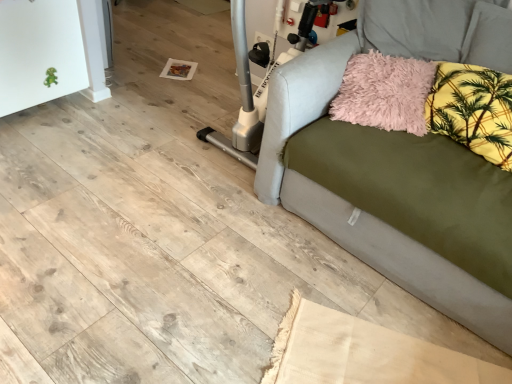
Question: Is beige fabric rug at lower center at the right side of yellow floral fabric pillow at upper right, acting as the 1th pillow starting from the right?

Choices:
 (A) no
 (B) yes

Answer: (A)

Question: Is the depth of beige fabric rug at lower center greater than that of yellow floral fabric pillow at upper right, acting as the 1th pillow starting from the right?

Choices:
 (A) yes
 (B) no

Answer: (B)

Question: From the image's perspective, is beige fabric rug at lower center located above yellow floral fabric pillow at upper right, the 2th pillow from the left?

Choices:
 (A) yes
 (B) no

Answer: (B)

Question: Considering the relative sizes of beige fabric rug at lower center and yellow floral fabric pillow at upper right, acting as the 1th pillow starting from the right, in the image provided, is beige fabric rug at lower center thinner than yellow floral fabric pillow at upper right, acting as the 1th pillow starting from the right,?

Choices:
 (A) no
 (B) yes

Answer: (A)

Question: Can you confirm if beige fabric rug at lower center is taller than yellow floral fabric pillow at upper right, acting as the 1th pillow starting from the right?

Choices:
 (A) yes
 (B) no

Answer: (B)

Question: Does beige fabric rug at lower center turn towards yellow floral fabric pillow at upper right, acting as the 1th pillow starting from the right?

Choices:
 (A) no
 (B) yes

Answer: (A)

Question: Does fluffy pink pillow at upper right, placed as the second pillow when sorted from right to left, have a greater height compared to yellow floral fabric pillow at upper right, the 2th pillow from the left?

Choices:
 (A) yes
 (B) no

Answer: (B)

Question: Is fluffy pink pillow at upper right, placed as the second pillow when sorted from right to left, in contact with yellow floral fabric pillow at upper right, acting as the 1th pillow starting from the right?

Choices:
 (A) yes
 (B) no

Answer: (B)

Question: From a real-world perspective, is fluffy pink pillow at upper right, which ranks as the first pillow in left-to-right order, positioned under yellow floral fabric pillow at upper right, the 2th pillow from the left, based on gravity?

Choices:
 (A) yes
 (B) no

Answer: (A)

Question: From a real-world perspective, is fluffy pink pillow at upper right, which ranks as the first pillow in left-to-right order, on yellow floral fabric pillow at upper right, the 2th pillow from the left?

Choices:
 (A) no
 (B) yes

Answer: (A)

Question: Can you confirm if fluffy pink pillow at upper right, which ranks as the first pillow in left-to-right order, is thinner than yellow floral fabric pillow at upper right, acting as the 1th pillow starting from the right?

Choices:
 (A) yes
 (B) no

Answer: (B)

Question: Is fluffy pink pillow at upper right, placed as the second pillow when sorted from right to left, bigger than yellow floral fabric pillow at upper right, the 2th pillow from the left?

Choices:
 (A) yes
 (B) no

Answer: (B)

Question: Is olive green fabric couch at right oriented away from beige fabric rug at lower center?

Choices:
 (A) no
 (B) yes

Answer: (A)